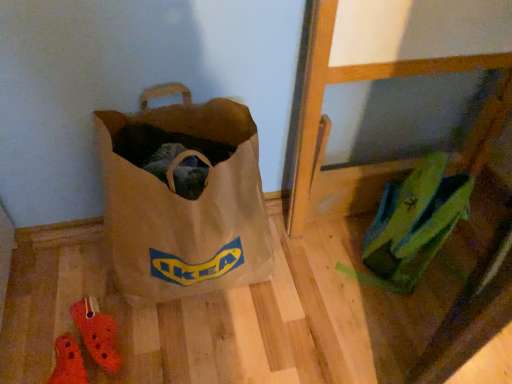
The image size is (512, 384). I want to click on free space between brown canvas bag at lower left and orange croc at lower left, the second footwear positioned from the bottom, so click(154, 319).